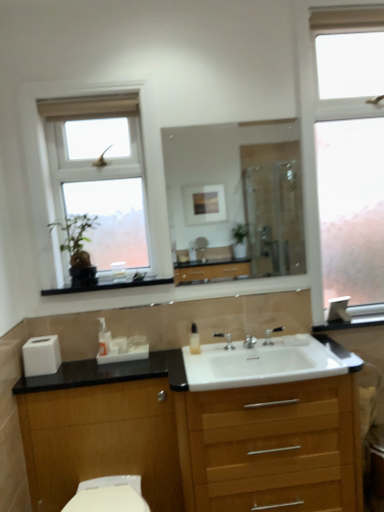
The height and width of the screenshot is (512, 384). In order to click on spots to the right of white matte toilet paper at lower left in this screenshot , I will do `click(71, 371)`.